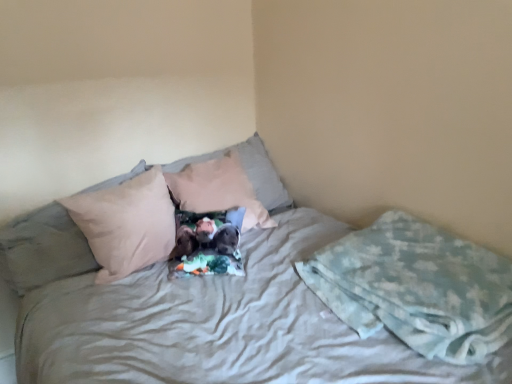
Question: Does beige fabric pillow at center, which is counted as the second pillow, starting from the left, touch light brown fabric pillow at center, arranged as the 1th pillow when viewed from the right?

Choices:
 (A) yes
 (B) no

Answer: (B)

Question: From the image's perspective, is beige fabric pillow at center, placed as the second pillow when sorted from right to left, beneath light brown fabric pillow at center, arranged as the 1th pillow when viewed from the right?

Choices:
 (A) no
 (B) yes

Answer: (B)

Question: Is beige fabric pillow at center, placed as the second pillow when sorted from right to left, outside light brown fabric pillow at center, arranged as the 1th pillow when viewed from the right?

Choices:
 (A) yes
 (B) no

Answer: (A)

Question: Does beige fabric pillow at center, which is counted as the second pillow, starting from the left, lie in front of light brown fabric pillow at center, arranged as the 1th pillow when viewed from the right?

Choices:
 (A) yes
 (B) no

Answer: (A)

Question: Could you tell me if beige fabric pillow at center, placed as the second pillow when sorted from right to left, is turned towards light brown fabric pillow at center, acting as the 3th pillow starting from the left?

Choices:
 (A) yes
 (B) no

Answer: (B)

Question: Does point (354, 309) appear closer or farther from the camera than point (4, 243)?

Choices:
 (A) farther
 (B) closer

Answer: (B)

Question: From a real-world perspective, is light blue textured blanket at lower right physically located above or below beige fabric pillow at left, which appears as the first pillow when viewed from the left?

Choices:
 (A) above
 (B) below

Answer: (B)

Question: Is light blue textured blanket at lower right bigger or smaller than beige fabric pillow at left, which appears as the first pillow when viewed from the left?

Choices:
 (A) small
 (B) big

Answer: (A)

Question: Which is correct: light blue textured blanket at lower right is inside beige fabric pillow at left, which appears as the 3th pillow when viewed from the right, or outside of it?

Choices:
 (A) outside
 (B) inside

Answer: (A)

Question: Looking at their shapes, would you say beige fabric pillow at left, which appears as the 3th pillow when viewed from the right, is wider or thinner than beige fabric pillow at center, placed as the second pillow when sorted from right to left?

Choices:
 (A) thin
 (B) wide

Answer: (B)

Question: From a real-world perspective, is beige fabric pillow at left, which appears as the first pillow when viewed from the left, physically located above or below beige fabric pillow at center, placed as the second pillow when sorted from right to left?

Choices:
 (A) above
 (B) below

Answer: (B)

Question: In the image, is beige fabric pillow at left, which appears as the 3th pillow when viewed from the right, positioned in front of or behind beige fabric pillow at center, placed as the second pillow when sorted from right to left?

Choices:
 (A) front
 (B) behind

Answer: (B)

Question: From the image's perspective, is beige fabric pillow at left, which appears as the first pillow when viewed from the left, positioned above or below beige fabric pillow at center, which is counted as the second pillow, starting from the left?

Choices:
 (A) above
 (B) below

Answer: (A)

Question: Would you say light brown fabric pillow at center, arranged as the 1th pillow when viewed from the right, is inside or outside beige fabric pillow at left, which appears as the first pillow when viewed from the left?

Choices:
 (A) outside
 (B) inside

Answer: (A)

Question: Considering their positions, is light brown fabric pillow at center, acting as the 3th pillow starting from the left, located in front of or behind beige fabric pillow at left, which appears as the 3th pillow when viewed from the right?

Choices:
 (A) behind
 (B) front

Answer: (A)